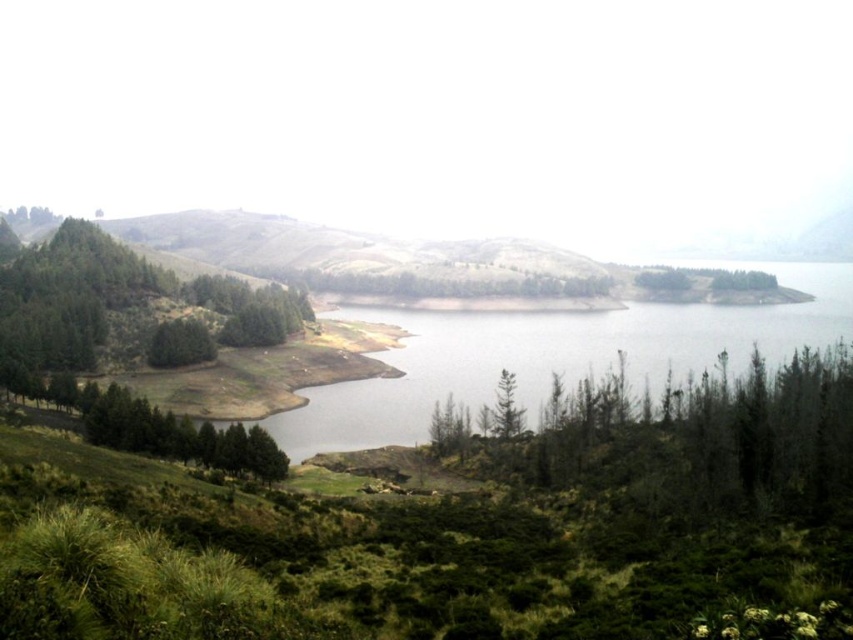
Question: Does green matte tree at lower left appear under green leafy tree at center?

Choices:
 (A) no
 (B) yes

Answer: (A)

Question: Is clear water at center behind green leafy trees at left?

Choices:
 (A) yes
 (B) no

Answer: (B)

Question: Does green matte trees at center appear over clear water at center?

Choices:
 (A) yes
 (B) no

Answer: (B)

Question: Considering the real-world distances, which object is farthest from the clear water at center?

Choices:
 (A) green matte trees at center
 (B) green leafy tree at center
 (C) green matte tree at lower left
 (D) green leafy trees at left

Answer: (D)

Question: Among these objects, which one is nearest to the camera?

Choices:
 (A) green matte trees at center
 (B) green leafy tree at center

Answer: (A)

Question: Among these points, which one is farthest from the camera?

Choices:
 (A) click(833, 424)
 (B) click(167, 342)
 (C) click(390, 419)

Answer: (B)